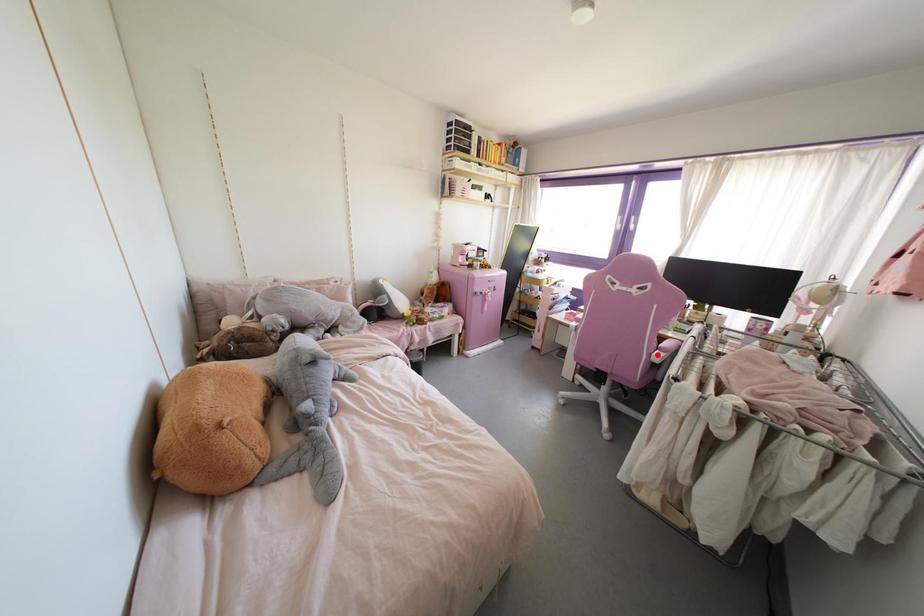
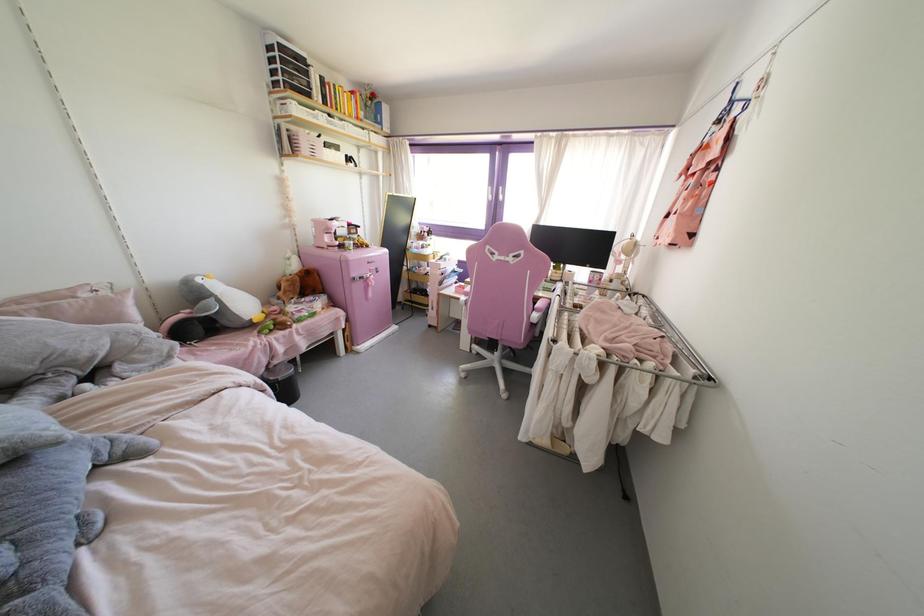
Find the pixel in the second image that matches the highlighted location in the first image.

(535, 315)